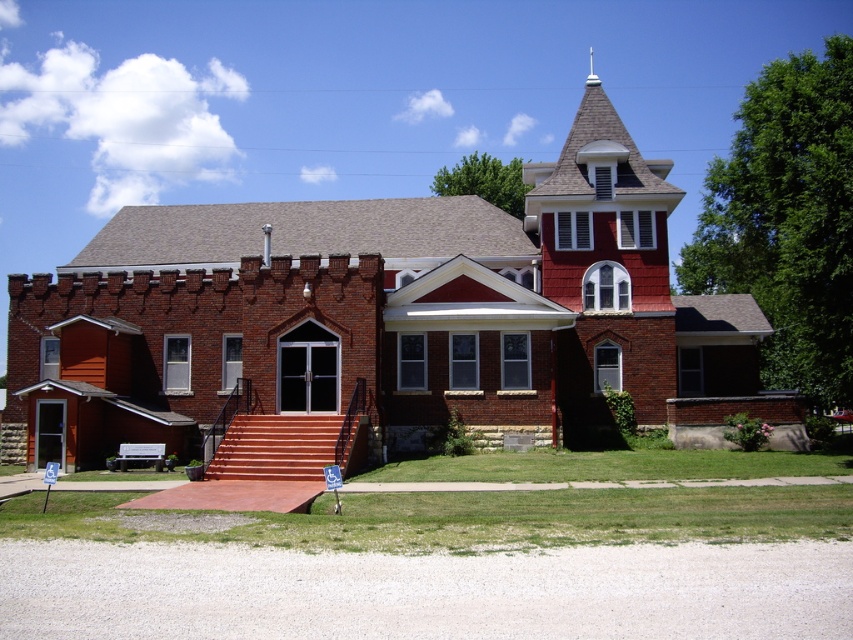
Question: Which point appears closest to the camera in this image?

Choices:
 (A) (666, 323)
 (B) (496, 372)

Answer: (B)

Question: Can you confirm if red brick church at center is positioned below shiny copper spire at upper center?

Choices:
 (A) yes
 (B) no

Answer: (A)

Question: Which of the following is the closest to the observer?

Choices:
 (A) red brick church at center
 (B) shiny copper spire at upper center

Answer: (A)

Question: Does red brick church at center have a smaller size compared to shiny copper spire at upper center?

Choices:
 (A) no
 (B) yes

Answer: (A)

Question: Can you confirm if red brick church at center is positioned below shiny copper spire at upper center?

Choices:
 (A) yes
 (B) no

Answer: (A)

Question: Which point is farther from the camera taking this photo?

Choices:
 (A) (618, 150)
 (B) (100, 291)

Answer: (A)